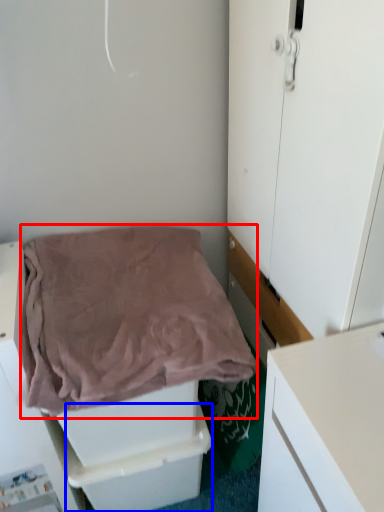
Question: Which object appears farthest to the camera in this image, blanket (highlighted by a red box) or drawer (highlighted by a blue box)?

Choices:
 (A) blanket
 (B) drawer

Answer: (B)